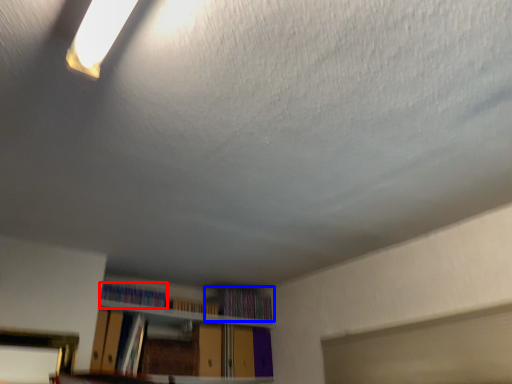
Question: Which of the following is the farthest to the observer, book (highlighted by a red box) or book (highlighted by a blue box)?

Choices:
 (A) book
 (B) book

Answer: (B)